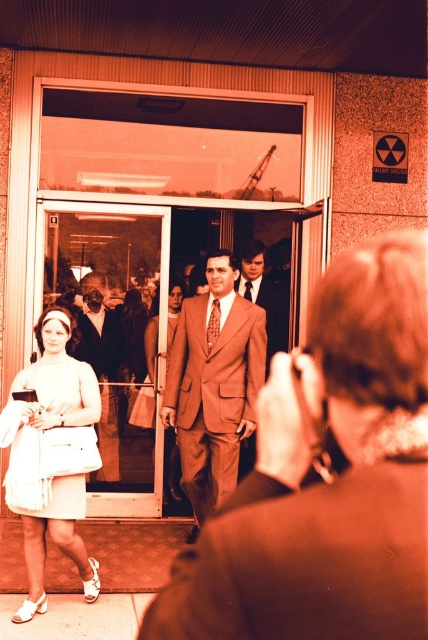
Is matte white dress at lower left taller than satin brown suit at center?

In fact, matte white dress at lower left may be shorter than satin brown suit at center.

Who is more forward, [404,508] or [98,440]?

Point [404,508] is more forward.

Where is `matte white dress at lower left`? The height and width of the screenshot is (640, 428). matte white dress at lower left is located at coordinates (327, 481).

Between matte brown suit at center and brown wool suit at center, which one has more height?

With more height is matte brown suit at center.

Does matte brown suit at center have a larger size compared to brown wool suit at center?

Yes.

Between point (249, 420) and point (270, 358), which one is positioned behind?

The point (270, 358) is behind.

Where is `matte brown suit at center`? The width and height of the screenshot is (428, 640). matte brown suit at center is located at coordinates (214, 385).

Can you confirm if matte brown suit at center is shorter than white satin dress at lower left?

No.

Does matte brown suit at center lie in front of white satin dress at lower left?

No, it is not.

The height and width of the screenshot is (640, 428). What do you see at coordinates (214, 385) in the screenshot?
I see `matte brown suit at center` at bounding box center [214, 385].

The image size is (428, 640). Find the location of `matte brown suit at center`. matte brown suit at center is located at coordinates (214, 385).